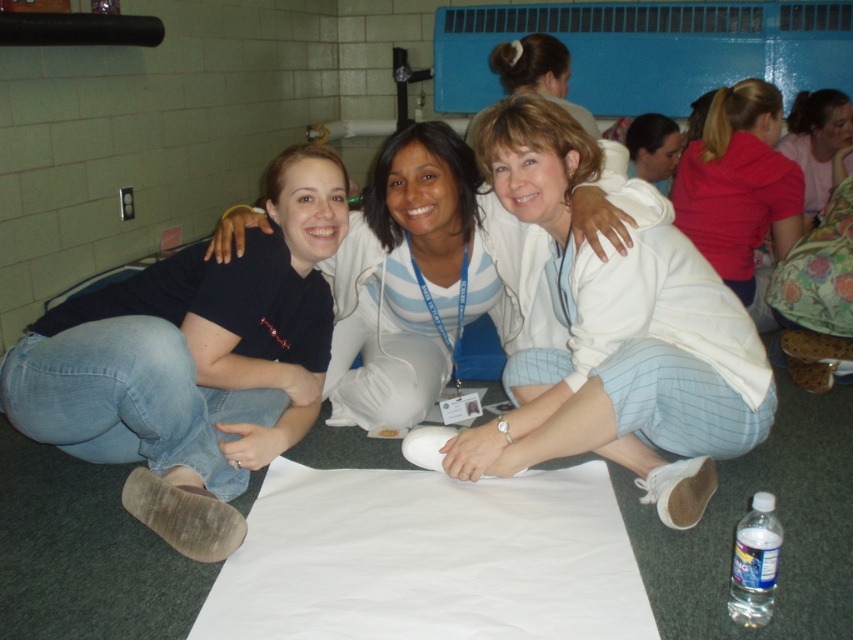
Question: Which is farther from the pink fabric at upper right?

Choices:
 (A) denim jeans at left
 (B) white soft sweater at center

Answer: (A)

Question: Considering the real-world distances, which object is closest to the denim jeans at left?

Choices:
 (A) white soft sweater at center
 (B) pink fabric at upper right

Answer: (A)

Question: Among these objects, which one is farthest from the camera?

Choices:
 (A) white soft sweater at center
 (B) denim jeans at left
 (C) white cotton shirt at center

Answer: (C)

Question: Considering the relative positions of white soft sweater at center and white cotton shirt at center in the image provided, where is white soft sweater at center located with respect to white cotton shirt at center?

Choices:
 (A) left
 (B) right

Answer: (B)

Question: Can you confirm if denim jeans at left is positioned to the right of white soft sweater at center?

Choices:
 (A) yes
 (B) no

Answer: (B)

Question: Can you confirm if white soft sweater at center is positioned below white cotton shirt at center?

Choices:
 (A) no
 (B) yes

Answer: (B)